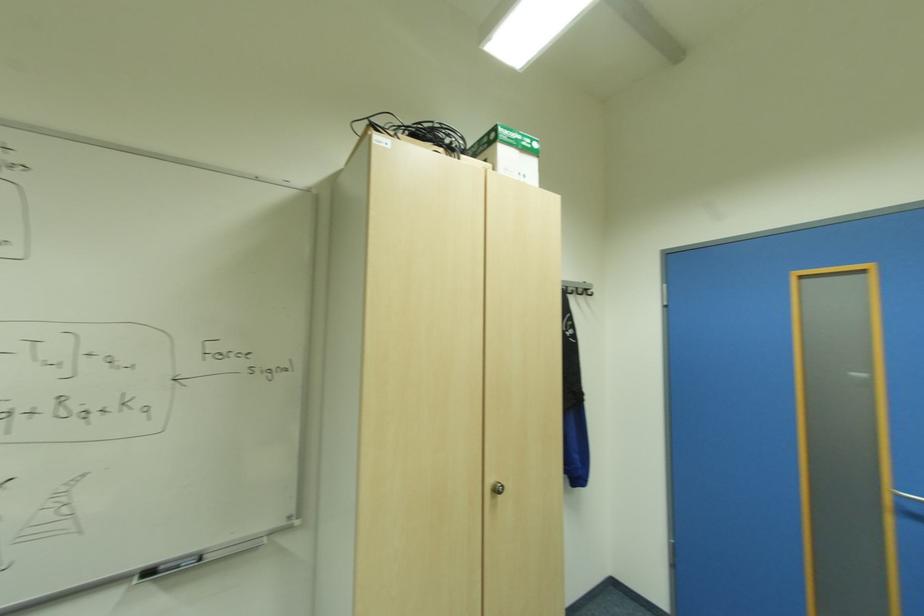
Where is `silver door handle`? Image resolution: width=924 pixels, height=616 pixels. silver door handle is located at coordinates (496, 488).